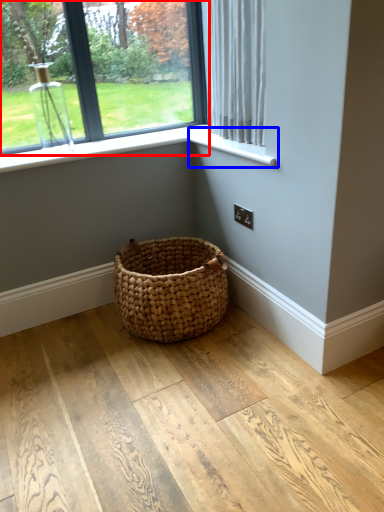
Question: Which point is closer to the camera, window (highlighted by a red box) or window sill (highlighted by a blue box)?

Choices:
 (A) window
 (B) window sill

Answer: (B)